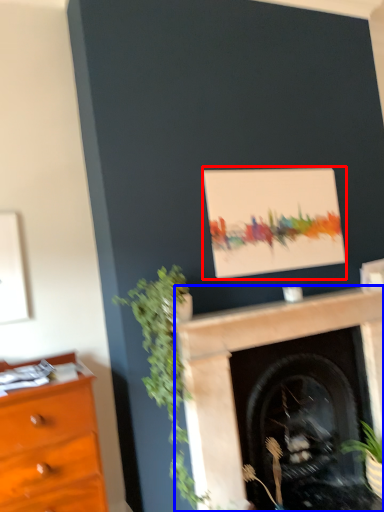
Question: Which point is closer to the camera, picture frame (highlighted by a red box) or fireplace (highlighted by a blue box)?

Choices:
 (A) picture frame
 (B) fireplace

Answer: (B)